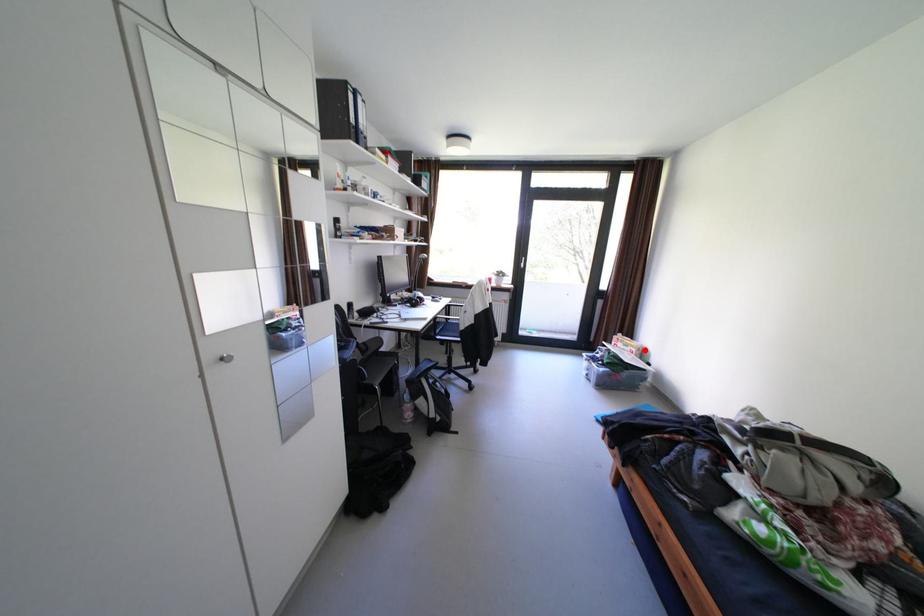
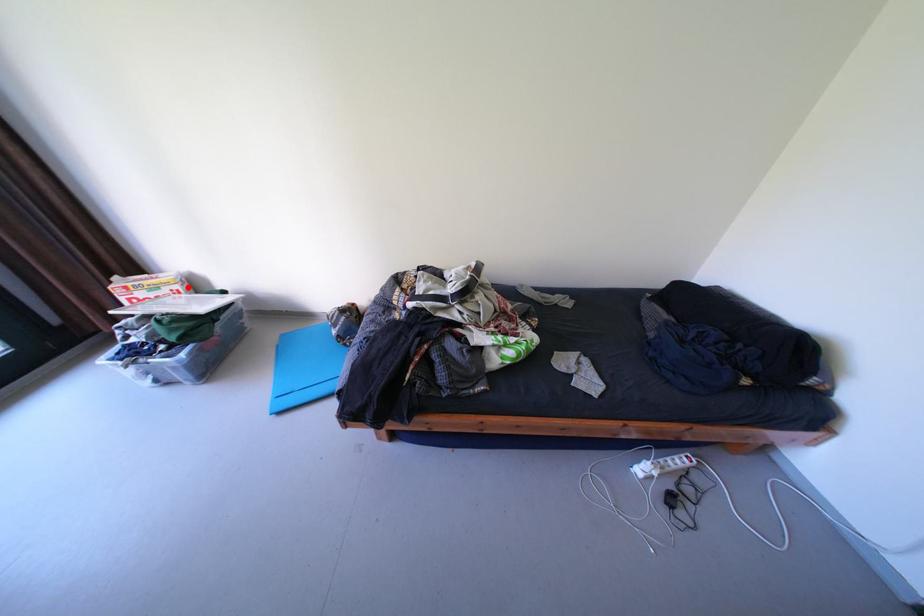
I am providing you with two images of the same scene from different viewpoints. A red point is marked on the first image and another point is marked on the second image. Do the highlighted points in image1 and image2 indicate the same real-world spot?

Yes